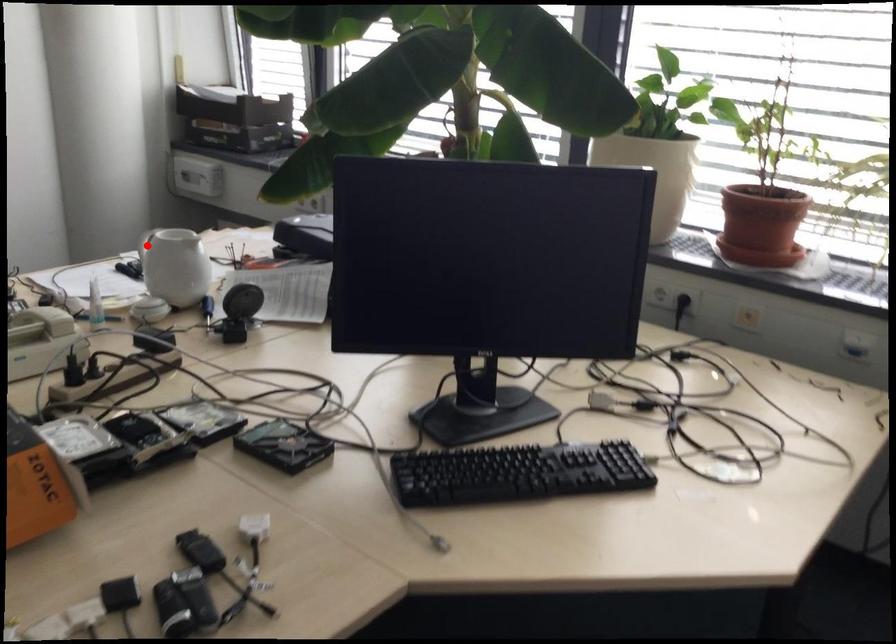
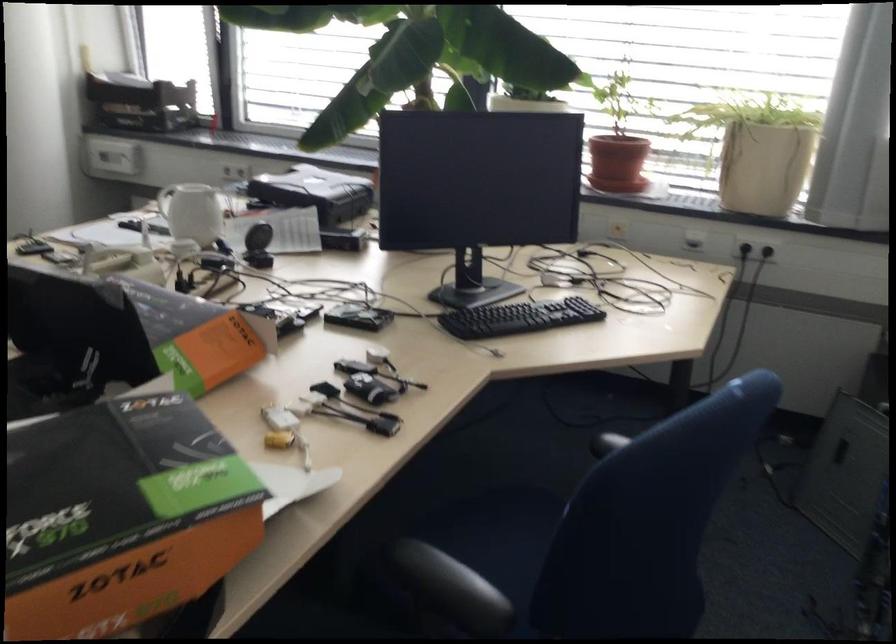
Find the pixel in the second image that matches the highlighted location in the first image.

(165, 200)